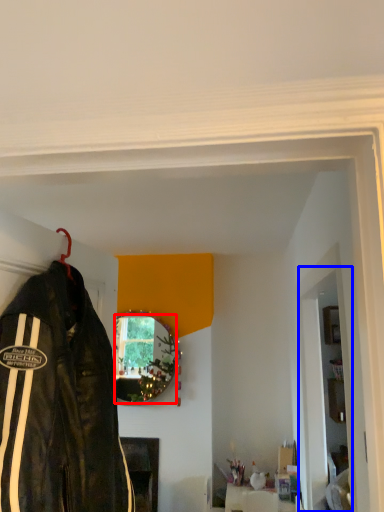
Question: Which object is closer to the camera taking this photo, mirror (highlighted by a red box) or garage door (highlighted by a blue box)?

Choices:
 (A) mirror
 (B) garage door

Answer: (B)